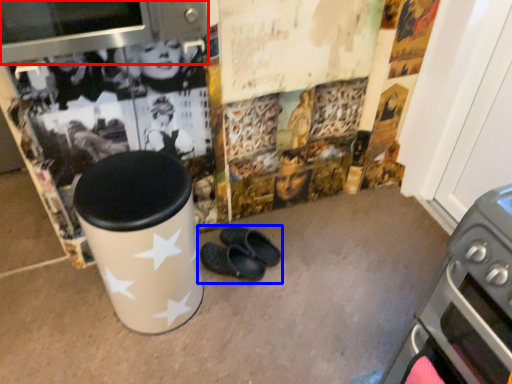
Question: Which object appears closest to the camera in this image, appliance (highlighted by a red box) or footwear (highlighted by a blue box)?

Choices:
 (A) appliance
 (B) footwear

Answer: (A)